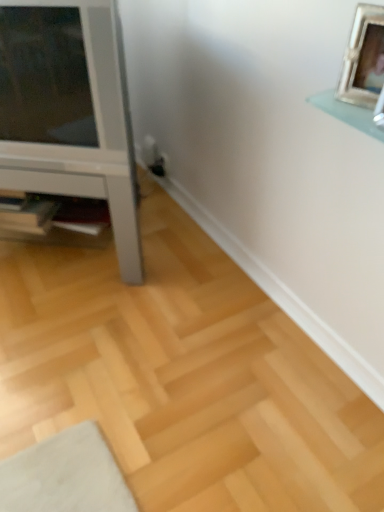
The image size is (384, 512). In order to click on free space in front of white glossy tv stand at left in this screenshot , I will do `click(87, 343)`.